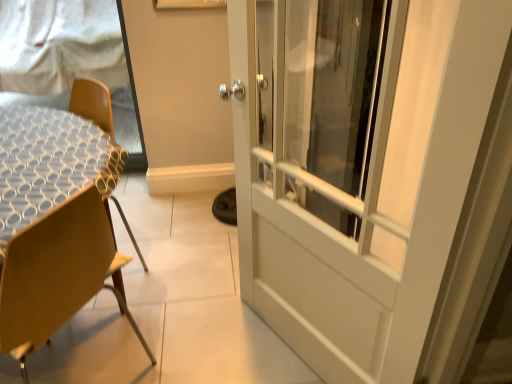
Question: From the image's perspective, would you say white textured table at left is positioned over white mesh screen at upper left?

Choices:
 (A) no
 (B) yes

Answer: (A)

Question: Is white textured table at left next to white mesh screen at upper left?

Choices:
 (A) yes
 (B) no

Answer: (B)

Question: Is white textured table at left thinner than white mesh screen at upper left?

Choices:
 (A) yes
 (B) no

Answer: (B)

Question: From a real-world perspective, is white textured table at left physically above white mesh screen at upper left?

Choices:
 (A) no
 (B) yes

Answer: (A)

Question: From a real-world perspective, is white textured table at left positioned under white mesh screen at upper left based on gravity?

Choices:
 (A) yes
 (B) no

Answer: (A)

Question: From a real-world perspective, is white textured table at left positioned above or below white mesh screen at upper left?

Choices:
 (A) below
 (B) above

Answer: (A)

Question: Visually, is white textured table at left positioned to the left or to the right of white mesh screen at upper left?

Choices:
 (A) left
 (B) right

Answer: (B)

Question: From the image's perspective, relative to white mesh screen at upper left, is white textured table at left above or below?

Choices:
 (A) below
 (B) above

Answer: (A)

Question: Based on their sizes in the image, would you say white textured table at left is bigger or smaller than white mesh screen at upper left?

Choices:
 (A) big
 (B) small

Answer: (A)

Question: Considering the positions of wooden chair at left and white textured table at left in the image, is wooden chair at left wider or thinner than white textured table at left?

Choices:
 (A) wide
 (B) thin

Answer: (A)

Question: Is wooden chair at left to the left or to the right of white textured table at left in the image?

Choices:
 (A) right
 (B) left

Answer: (A)

Question: From their relative heights in the image, would you say wooden chair at left is taller or shorter than white textured table at left?

Choices:
 (A) short
 (B) tall

Answer: (A)

Question: Which is correct: wooden chair at left is inside white textured table at left, or outside of it?

Choices:
 (A) inside
 (B) outside

Answer: (B)

Question: From the image's perspective, relative to white textured table at left, is white mesh screen at upper left above or below?

Choices:
 (A) below
 (B) above

Answer: (B)

Question: Looking at their shapes, would you say white mesh screen at upper left is wider or thinner than white textured table at left?

Choices:
 (A) wide
 (B) thin

Answer: (B)